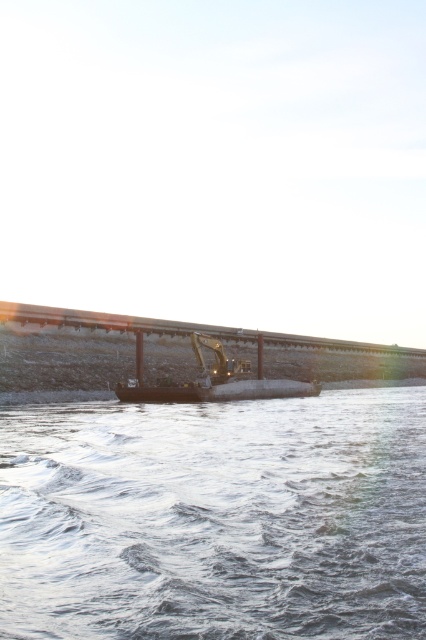
Question: Which of the following is the farthest from the observer?

Choices:
 (A) metallic yellow excavator at center
 (B) clear water at lower center
 (C) concrete bridge at center

Answer: (C)

Question: Does concrete bridge at center appear over metallic yellow excavator at center?

Choices:
 (A) yes
 (B) no

Answer: (A)

Question: Which of the following is the farthest from the observer?

Choices:
 (A) (219, 496)
 (B) (411, 374)
 (C) (218, 340)

Answer: (B)

Question: Can you confirm if concrete bridge at center is bigger than metallic yellow excavator at center?

Choices:
 (A) no
 (B) yes

Answer: (B)

Question: Is clear water at lower center further to camera compared to concrete bridge at center?

Choices:
 (A) yes
 (B) no

Answer: (B)

Question: Estimate the real-world distances between objects in this image. Which object is closer to the metallic yellow excavator at center?

Choices:
 (A) concrete bridge at center
 (B) clear water at lower center

Answer: (A)